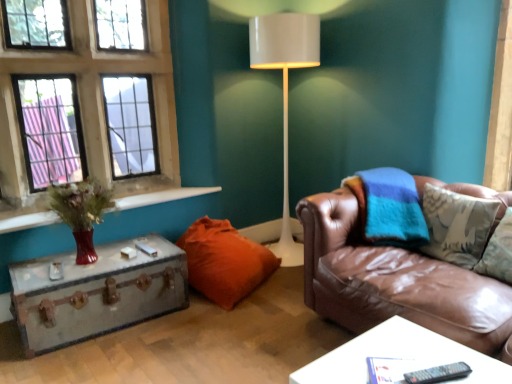
This screenshot has height=384, width=512. Find the location of `white glossy floor lamp at center`. white glossy floor lamp at center is located at coordinates 285,90.

What do you see at coordinates (394, 281) in the screenshot?
I see `brown leather couch at right` at bounding box center [394, 281].

Measure the distance between point (314, 277) and camera.

Point (314, 277) is 7.67 feet away from camera.

The image size is (512, 384). Describe the element at coordinates (161, 197) in the screenshot. I see `matte glass vase at left` at that location.

Image resolution: width=512 pixels, height=384 pixels. What do you see at coordinates (224, 261) in the screenshot?
I see `orange fabric pillow at lower center` at bounding box center [224, 261].

Identify the location of glass paneled window at upper left. Image resolution: width=512 pixels, height=384 pixels. (92, 100).

You are a GUI agent. You are given a task and a screenshot of the screen. Output one action in this format:
    pyautogui.click(x=<x>, y=<y>)
    Task: Click on the white glossy floor lamp at center
    The width and height of the screenshot is (512, 384).
    Given the screenshot: What is the action you would take?
    click(x=285, y=90)

Can you confirm if orange fabric pillow at lower center is wider than white glossy floor lamp at center?

Yes, orange fabric pillow at lower center is wider than white glossy floor lamp at center.

Where is `lamp above the orange fabric pillow at lower center (from a real-world perspective)`? The image size is (512, 384). lamp above the orange fabric pillow at lower center (from a real-world perspective) is located at coordinates (285, 90).

From a real-world perspective, is orange fabric pillow at lower center above or below white glossy floor lamp at center?

Clearly, from a real-world perspective, orange fabric pillow at lower center is below white glossy floor lamp at center.

Is orange fabric pillow at lower center oriented away from matte glass vase at left?

That's not correct — orange fabric pillow at lower center is not looking away from matte glass vase at left.

Is orange fabric pillow at lower center positioned beyond the bounds of matte glass vase at left?

Yes.

In the image, is orange fabric pillow at lower center on the left side or the right side of matte glass vase at left?

orange fabric pillow at lower center is to the right of matte glass vase at left.

Based on the photo, from a real-world perspective, is brown leather couch at right above or below matte glass vase at left?

Clearly, from a real-world perspective, brown leather couch at right is below matte glass vase at left.

Find the location of a particular element. studio couch that appears in front of the matte glass vase at left is located at coordinates pyautogui.click(x=394, y=281).

Is brown leather couch at right not within matte glass vase at left?

Absolutely, brown leather couch at right is external to matte glass vase at left.

Is brown leather couch at right oriented towards matte glass vase at left?

No, brown leather couch at right does not turn towards matte glass vase at left.

In terms of size, does black plastic remote at lower right appear bigger or smaller than glass paneled window at upper left?

black plastic remote at lower right is smaller than glass paneled window at upper left.

From the image's perspective, is black plastic remote at lower right located beneath glass paneled window at upper left?

Yes, from the image's perspective, black plastic remote at lower right is below glass paneled window at upper left.

Does black plastic remote at lower right appear on the right side of glass paneled window at upper left?

Yes, black plastic remote at lower right is to the right of glass paneled window at upper left.

Between matte glass vase at left and black plastic remote at lower right, which one has more height?

matte glass vase at left.

Can you tell me how much matte glass vase at left and black plastic remote at lower right differ in facing direction?

The angular difference between matte glass vase at left and black plastic remote at lower right is 68.1 degrees.

Does matte glass vase at left have a lesser width compared to black plastic remote at lower right?

No, matte glass vase at left is not thinner than black plastic remote at lower right.

Is point (132, 198) closer to viewer compared to point (416, 379)?

No.

Is orange fabric pillow at lower center beside brown leather couch at right?

No, orange fabric pillow at lower center is not in contact with brown leather couch at right.

Is orange fabric pillow at lower center closer to the viewer compared to brown leather couch at right?

No.

From a real-world perspective, does orange fabric pillow at lower center sit lower than brown leather couch at right?

Yes, from a real-world perspective, orange fabric pillow at lower center is beneath brown leather couch at right.

Which object is positioned more to the right, orange fabric pillow at lower center or brown leather couch at right?

Positioned to the right is brown leather couch at right.

Based on their positions, is white glossy table at lower right, the 1th table from the right, located to the left or right of white glossy floor lamp at center?

In the image, white glossy table at lower right, the 1th table from the right, appears on the right side of white glossy floor lamp at center.

What's the angular difference between white glossy table at lower right, the 1th table from the right, and white glossy floor lamp at center's facing directions?

3.02 degrees.

In the scene shown: Is white glossy table at lower right, positioned as the first table in front-to-back order, looking in the opposite direction of white glossy floor lamp at center?

That's not correct — white glossy table at lower right, positioned as the first table in front-to-back order, is not looking away from white glossy floor lamp at center.

This screenshot has width=512, height=384. Find the location of `pillow below the white glossy floor lamp at center (from the image's perspective)`. pillow below the white glossy floor lamp at center (from the image's perspective) is located at coordinates (224, 261).

There is a orange fabric pillow at lower center. In order to click on window sill above it (from a real-world perspective) in this screenshot , I will do pyautogui.click(x=161, y=197).

Based on their spatial positions, is orange fabric pillow at lower center or matte glass vase at left further from white glossy table at lower right, arranged as the second table when viewed from the back?

Among the two, matte glass vase at left is located further to white glossy table at lower right, arranged as the second table when viewed from the back.

Considering their positions, is metallic suitcase at left, the 1th table from the left, positioned closer to matte glass vase at left than black plastic remote at lower right?

metallic suitcase at left, the 1th table from the left, is closer to matte glass vase at left.

Considering their positions, is white glossy floor lamp at center positioned closer to brown leather couch at right than glass paneled window at upper left?

white glossy floor lamp at center is positioned closer to the anchor brown leather couch at right.

Estimate the real-world distances between objects in this image. Which object is closer to white glossy table at lower right, positioned as the first table in front-to-back order, brown leather couch at right or white glossy floor lamp at center?

Based on the image, brown leather couch at right appears to be nearer to white glossy table at lower right, positioned as the first table in front-to-back order.

Based on their spatial positions, is white glossy table at lower right, positioned as the first table in front-to-back order, or white glossy floor lamp at center closer to metallic suitcase at left, the 1th table from the left?

white glossy table at lower right, positioned as the first table in front-to-back order, is closer to metallic suitcase at left, the 1th table from the left.

From the picture: Looking at the image, which one is located further to white glossy floor lamp at center, matte glass vase at left or brown leather couch at right?

brown leather couch at right lies further to white glossy floor lamp at center than the other object.

Estimate the real-world distances between objects in this image. Which object is closer to orange fabric pillow at lower center, white glossy floor lamp at center or glass paneled window at upper left?

glass paneled window at upper left.

Considering their positions, is white glossy floor lamp at center positioned further to white glossy table at lower right, positioned as the first table in front-to-back order, than orange fabric pillow at lower center?

white glossy floor lamp at center is positioned further to the anchor white glossy table at lower right, positioned as the first table in front-to-back order.

This screenshot has height=384, width=512. Identify the location of remote situated between metallic suitcase at left, placed as the second table when sorted from right to left, and brown leather couch at right from left to right. (438, 374).

Where is `window sill that lies between glass paneled window at upper left and metallic suitcase at left, which ranks as the second table in front-to-back order, from top to bottom`? The image size is (512, 384). window sill that lies between glass paneled window at upper left and metallic suitcase at left, which ranks as the second table in front-to-back order, from top to bottom is located at coordinates (161, 197).

Find the location of a particular element. The image size is (512, 384). table between metallic suitcase at left, placed as the second table when sorted from right to left, and black plastic remote at lower right is located at coordinates (399, 356).

Where is `pillow located between metallic suitcase at left, the 1th table in the back-to-front sequence, and black plastic remote at lower right in the left-right direction`? This screenshot has width=512, height=384. pillow located between metallic suitcase at left, the 1th table in the back-to-front sequence, and black plastic remote at lower right in the left-right direction is located at coordinates (224, 261).